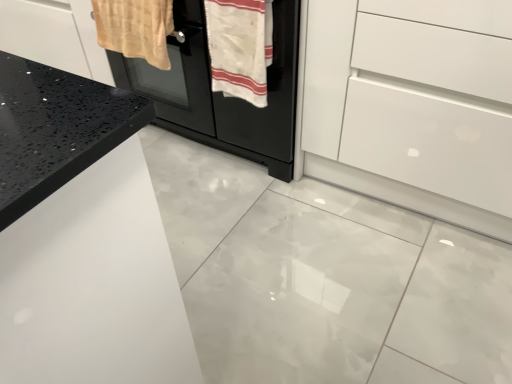
The image size is (512, 384). What do you see at coordinates (411, 109) in the screenshot? I see `white glossy drawer at center` at bounding box center [411, 109].

Describe the element at coordinates (135, 28) in the screenshot. I see `beige woven towel at upper left, positioned as the second bath towel in right-to-left order` at that location.

Measure the distance between black matte oven at center and camera.

A distance of 4.04 feet exists between black matte oven at center and camera.

The height and width of the screenshot is (384, 512). In order to click on white glossy drawer at center in this screenshot , I will do `click(411, 109)`.

Who is more distant, black matte oven at center or white glossy drawer at center?

black matte oven at center is more distant.

From the image's perspective, between black matte oven at center and white glossy drawer at center, which one is located above?

black matte oven at center is shown above in the image.

Based on the photo, which point is more forward, [229,108] or [456,191]?

The point [456,191] is in front.

Between black matte oven at center and white glossy drawer at center, which one has smaller size?

With smaller size is white glossy drawer at center.

Can you confirm if black matte oven at center is bigger than beige woven towel at upper left, which is the 1th bath towel from left to right?

Yes.

From the picture: Does black matte oven at center touch beige woven towel at upper left, which is the 1th bath towel from left to right?

No, black matte oven at center is not beside beige woven towel at upper left, which is the 1th bath towel from left to right.

Which object is wider, black matte oven at center or beige woven towel at upper left, positioned as the second bath towel in right-to-left order?

black matte oven at center is wider.

Is point (203, 93) less distant than point (142, 52)?

No, (203, 93) is further to viewer.

How different are the orientations of white glossy drawer at center and black matte oven at center in degrees?

There is a 1.64-degree angle between the facing directions of white glossy drawer at center and black matte oven at center.

From the picture: From the image's perspective, between white glossy drawer at center and black matte oven at center, who is located below?

white glossy drawer at center, from the image's perspective.

Does white glossy drawer at center turn towards black matte oven at center?

No, white glossy drawer at center is not turned towards black matte oven at center.

Measure the distance between white glossy drawer at center and black matte oven at center.

A distance of 15.00 inches exists between white glossy drawer at center and black matte oven at center.

Is white cotton towel at center, the first bath towel in the right-to-left sequence, in front of or behind white glossy drawer at center in the image?

In the image, white cotton towel at center, the first bath towel in the right-to-left sequence, appears behind white glossy drawer at center.

From the picture: How different are the orientations of white cotton towel at center, marked as the 2th bath towel in a left-to-right arrangement, and white glossy drawer at center in degrees?

white cotton towel at center, marked as the 2th bath towel in a left-to-right arrangement, and white glossy drawer at center are facing 1.64 degrees away from each other.

Is white cotton towel at center, marked as the 2th bath towel in a left-to-right arrangement, to the right of white glossy drawer at center from the viewer's perspective?

In fact, white cotton towel at center, marked as the 2th bath towel in a left-to-right arrangement, is to the left of white glossy drawer at center.

Is white cotton towel at center, the first bath towel in the right-to-left sequence, positioned far away from white glossy drawer at center?

That's not correct — white cotton towel at center, the first bath towel in the right-to-left sequence, is a little close to white glossy drawer at center.

Considering the relative sizes of beige woven towel at upper left, which is the 1th bath towel from left to right, and black matte oven at center in the image provided, is beige woven towel at upper left, which is the 1th bath towel from left to right, thinner than black matte oven at center?

Correct, the width of beige woven towel at upper left, which is the 1th bath towel from left to right, is less than that of black matte oven at center.

Is beige woven towel at upper left, positioned as the second bath towel in right-to-left order, directly adjacent to black matte oven at center?

No, beige woven towel at upper left, positioned as the second bath towel in right-to-left order, is not next to black matte oven at center.

At what (x,y) coordinates should I click in order to perform the action: click on oven in front of the beige woven towel at upper left, positioned as the second bath towel in right-to-left order. Please return your answer as a coordinate pair (x, y). Looking at the image, I should click on (220, 92).

Who is shorter, beige woven towel at upper left, positioned as the second bath towel in right-to-left order, or black matte oven at center?

beige woven towel at upper left, positioned as the second bath towel in right-to-left order.

In terms of height, does white cotton towel at center, the first bath towel in the right-to-left sequence, look taller or shorter compared to black matte oven at center?

Considering their sizes, white cotton towel at center, the first bath towel in the right-to-left sequence, has less height than black matte oven at center.

Would you say white cotton towel at center, the first bath towel in the right-to-left sequence, is to the left or to the right of black matte oven at center in the picture?

From the image, it's evident that white cotton towel at center, the first bath towel in the right-to-left sequence, is to the right of black matte oven at center.

Looking at this image, would you say white cotton towel at center, marked as the 2th bath towel in a left-to-right arrangement, is inside or outside black matte oven at center?

white cotton towel at center, marked as the 2th bath towel in a left-to-right arrangement, cannot be found inside black matte oven at center.

Would you consider white cotton towel at center, the first bath towel in the right-to-left sequence, to be distant from black matte oven at center?

No, white cotton towel at center, the first bath towel in the right-to-left sequence, is in close proximity to black matte oven at center.

Is beige woven towel at upper left, which is the 1th bath towel from left to right, taller than white cotton towel at center, the first bath towel in the right-to-left sequence?

No.

Can you confirm if beige woven towel at upper left, which is the 1th bath towel from left to right, is positioned to the left of white cotton towel at center, marked as the 2th bath towel in a left-to-right arrangement?

Correct, you'll find beige woven towel at upper left, which is the 1th bath towel from left to right, to the left of white cotton towel at center, marked as the 2th bath towel in a left-to-right arrangement.

Is beige woven towel at upper left, positioned as the second bath towel in right-to-left order, positioned in front of white cotton towel at center, the first bath towel in the right-to-left sequence?

No, beige woven towel at upper left, positioned as the second bath towel in right-to-left order, is further to the viewer.

This screenshot has height=384, width=512. What are the coordinates of `bath towel located in front of the beige woven towel at upper left, positioned as the second bath towel in right-to-left order` in the screenshot? It's located at (240, 47).

Find the location of `the chest of drawers lying in front of the black matte oven at center`. the chest of drawers lying in front of the black matte oven at center is located at coordinates [411, 109].

In the image, there is a beige woven towel at upper left, which is the 1th bath towel from left to right. Identify the location of oven below it (from a real-world perspective). (220, 92).

From the image, which object appears to be nearer to black matte oven at center, white cotton towel at center, the first bath towel in the right-to-left sequence, or beige woven towel at upper left, which is the 1th bath towel from left to right?

Among the two, white cotton towel at center, the first bath towel in the right-to-left sequence, is located nearer to black matte oven at center.

Considering their positions, is beige woven towel at upper left, positioned as the second bath towel in right-to-left order, positioned further to black matte oven at center than white glossy drawer at center?

Based on the image, white glossy drawer at center appears to be further to black matte oven at center.

Which object lies nearer to the anchor point white glossy drawer at center, beige woven towel at upper left, positioned as the second bath towel in right-to-left order, or white cotton towel at center, the first bath towel in the right-to-left sequence?

white cotton towel at center, the first bath towel in the right-to-left sequence.

Estimate the real-world distances between objects in this image. Which object is closer to white glossy drawer at center, white cotton towel at center, marked as the 2th bath towel in a left-to-right arrangement, or beige woven towel at upper left, positioned as the second bath towel in right-to-left order?

The object closer to white glossy drawer at center is white cotton towel at center, marked as the 2th bath towel in a left-to-right arrangement.

Which object lies nearer to the anchor point white cotton towel at center, marked as the 2th bath towel in a left-to-right arrangement, black matte oven at center or beige woven towel at upper left, positioned as the second bath towel in right-to-left order?

black matte oven at center lies closer to white cotton towel at center, marked as the 2th bath towel in a left-to-right arrangement, than the other object.

Consider the image. Considering their positions, is beige woven towel at upper left, which is the 1th bath towel from left to right, positioned closer to white cotton towel at center, the first bath towel in the right-to-left sequence, than black matte oven at center?

The object closer to white cotton towel at center, the first bath towel in the right-to-left sequence, is black matte oven at center.

From the image, which object appears to be nearer to white cotton towel at center, marked as the 2th bath towel in a left-to-right arrangement, white glossy drawer at center or black matte oven at center?

black matte oven at center is closer to white cotton towel at center, marked as the 2th bath towel in a left-to-right arrangement.

From the image, which object appears to be nearer to white cotton towel at center, marked as the 2th bath towel in a left-to-right arrangement, black matte oven at center or white glossy drawer at center?

black matte oven at center lies closer to white cotton towel at center, marked as the 2th bath towel in a left-to-right arrangement, than the other object.

Find the location of `oven situated between beige woven towel at upper left, positioned as the second bath towel in right-to-left order, and white glossy drawer at center from left to right`. oven situated between beige woven towel at upper left, positioned as the second bath towel in right-to-left order, and white glossy drawer at center from left to right is located at coordinates (220, 92).

Where is `bath towel between beige woven towel at upper left, which is the 1th bath towel from left to right, and white glossy drawer at center`? The width and height of the screenshot is (512, 384). bath towel between beige woven towel at upper left, which is the 1th bath towel from left to right, and white glossy drawer at center is located at coordinates (240, 47).

The image size is (512, 384). I want to click on oven between beige woven towel at upper left, positioned as the second bath towel in right-to-left order, and white cotton towel at center, marked as the 2th bath towel in a left-to-right arrangement, so click(220, 92).

Identify the location of bath towel situated between black matte oven at center and white glossy drawer at center from left to right. point(240,47).